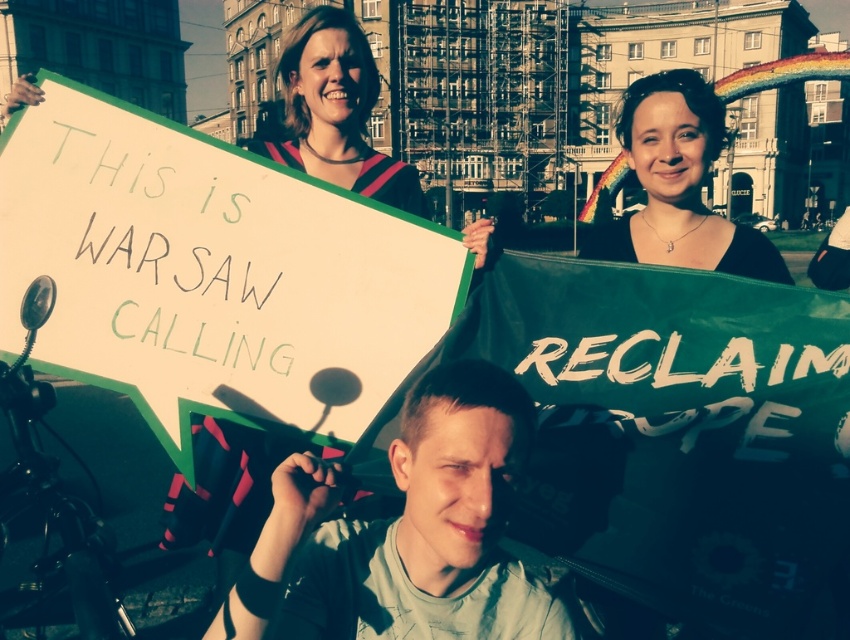
You are a photographer at the protest scene described. You want to take a photo that includes both the point at coordinates point [480,365] and point [678,93]. However, you notice that one of these points is closer to the camera than the other. Which point should you focus on first to ensure both are in focus?

Point [480,365] is in front of point [678,93], so you should focus on point [480,365] first to ensure both are in focus.

Based on the scene description, which object is taller between the white paper sign at upper left and the matte black hair at upper center?

The white paper sign at upper left is much taller than the matte black hair at upper center.